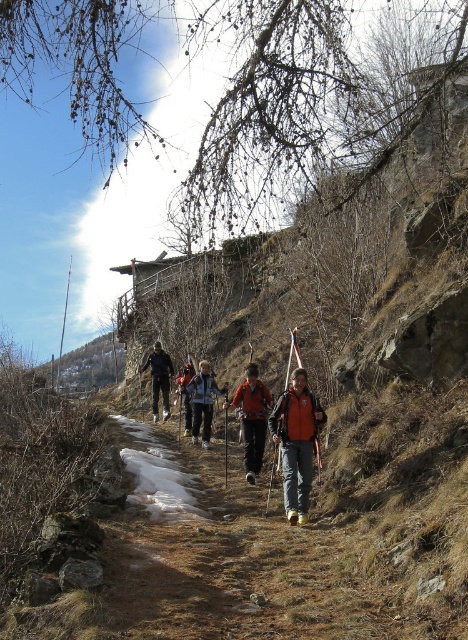
Does brown dirt path at center have a larger size compared to black fabric jacket at center?

No, brown dirt path at center is not bigger than black fabric jacket at center.

What are the coordinates of `brown dirt path at center` in the screenshot? It's located at (170, 548).

Does orange fleece jacket at center have a lesser height compared to black fabric jacket at center?

Indeed, orange fleece jacket at center has a lesser height compared to black fabric jacket at center.

I want to click on orange fleece jacket at center, so click(203, 401).

Image resolution: width=468 pixels, height=640 pixels. Find the location of `orange fleece jacket at center`. orange fleece jacket at center is located at coordinates (203, 401).

Is orange fleece jacket at center wider than orange fabric jacket at center?

Yes.

Can you confirm if orange fleece jacket at center is positioned to the right of orange fabric jacket at center?

Yes, orange fleece jacket at center is to the right of orange fabric jacket at center.

Describe the element at coordinates (203, 401) in the screenshot. I see `orange fleece jacket at center` at that location.

Identify the location of orange fleece jacket at center. The image size is (468, 640). (203, 401).